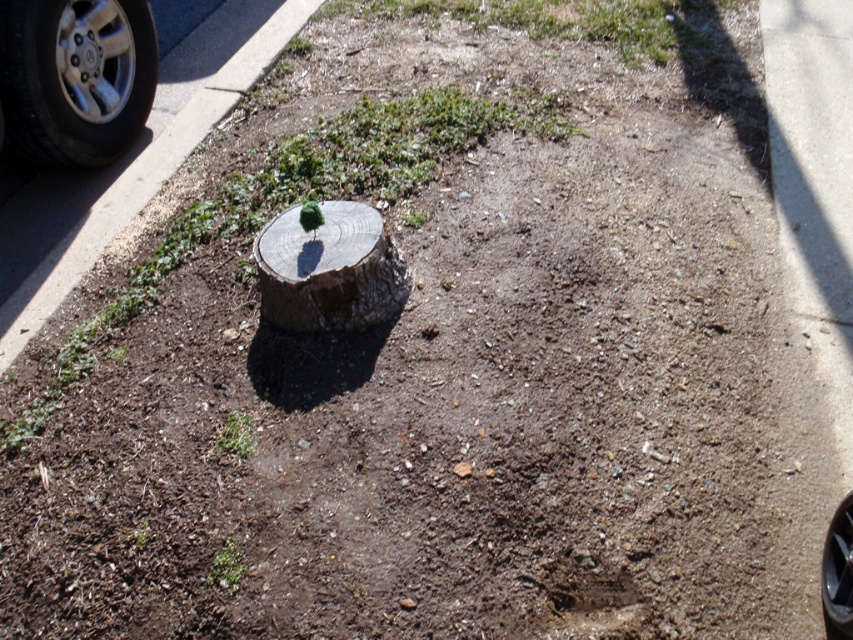
Between silver metallic tire at upper left and smooth brown tree stump at center, which one is positioned higher?

Positioned higher is silver metallic tire at upper left.

Is silver metallic tire at upper left above smooth brown tree stump at center?

Indeed, silver metallic tire at upper left is positioned over smooth brown tree stump at center.

Is point (33, 4) closer to viewer compared to point (331, 234)?

No, (33, 4) is further to viewer.

Locate an element on the screen. This screenshot has width=853, height=640. silver metallic tire at upper left is located at coordinates 74,77.

Is silver metallic tire at upper left further to the viewer compared to black rubber tire at lower right?

That is True.

Is point (48, 147) behind point (849, 608)?

Yes, it is.

Where is `silver metallic tire at upper left`? The image size is (853, 640). silver metallic tire at upper left is located at coordinates (74, 77).

Which is above, smooth brown tree stump at center or black rubber tire at lower right?

smooth brown tree stump at center

Between smooth brown tree stump at center and black rubber tire at lower right, which one appears on the left side from the viewer's perspective?

smooth brown tree stump at center

Describe the element at coordinates (329, 269) in the screenshot. The image size is (853, 640). I see `smooth brown tree stump at center` at that location.

Image resolution: width=853 pixels, height=640 pixels. Find the location of `smooth brown tree stump at center`. smooth brown tree stump at center is located at coordinates (329, 269).